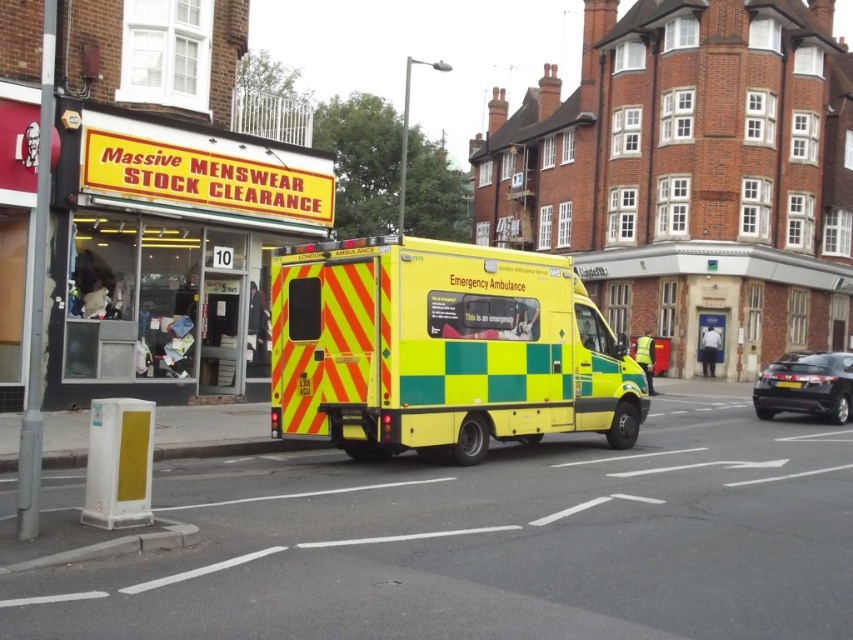
You are standing on the sidewalk and see two points marked on the ambulance. The first point is at coordinates point (x=396, y=365) and the second is at point (x=846, y=380). Which point is closer to you?

Point (x=396, y=365) is closer to the viewer than point (x=846, y=380).